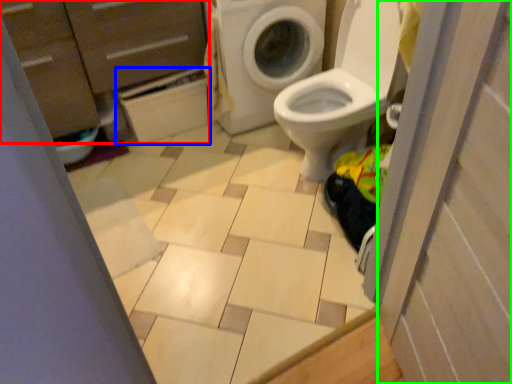
Question: Estimate the real-world distances between objects in this image. Which object is farther from dresser (highlighted by a red box), cabinetry (highlighted by a blue box) or screen door (highlighted by a green box)?

Choices:
 (A) cabinetry
 (B) screen door

Answer: (B)